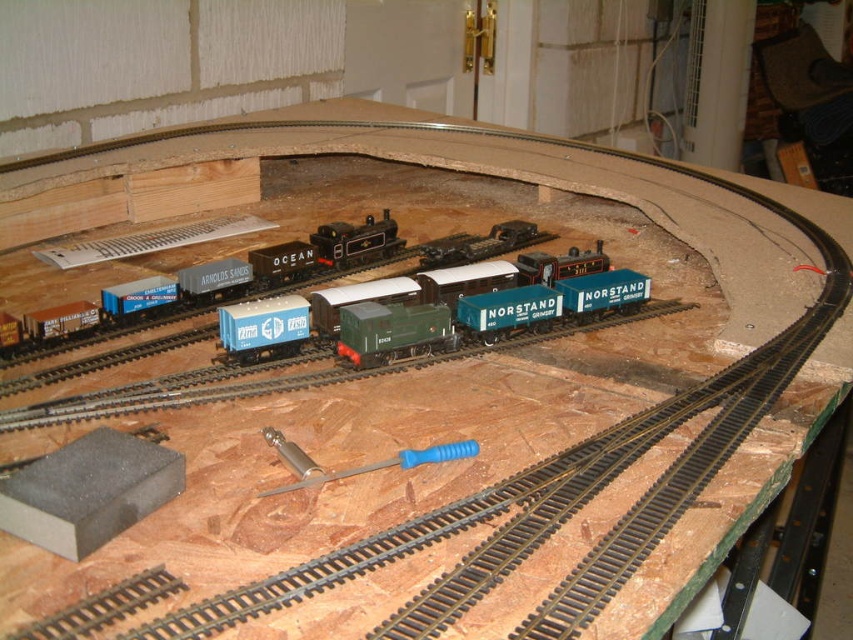
Question: Which of the following is the farthest from the observer?

Choices:
 (A) (x=160, y=276)
 (B) (x=297, y=349)
 (C) (x=502, y=296)

Answer: (A)

Question: Is blue matte train car at center to the right of blue matte freight car at center-left from the viewer's perspective?

Choices:
 (A) yes
 (B) no

Answer: (A)

Question: Estimate the real-world distances between objects in this image. Which object is closer to the teal matte freight car at center?

Choices:
 (A) blue matte train car at center
 (B) teal matte train car at center
 (C) blue matte freight car at center-left
 (D) blue-green plastic train at center

Answer: (B)

Question: Does green matte train car at center have a larger size compared to blue matte freight car at center-left?

Choices:
 (A) no
 (B) yes

Answer: (B)

Question: Which point is closer to the camera?

Choices:
 (A) (247, 305)
 (B) (480, 300)
 (C) (350, 470)

Answer: (C)

Question: Does teal matte train car at center have a smaller size compared to blue plastic screwdriver at center?

Choices:
 (A) no
 (B) yes

Answer: (B)